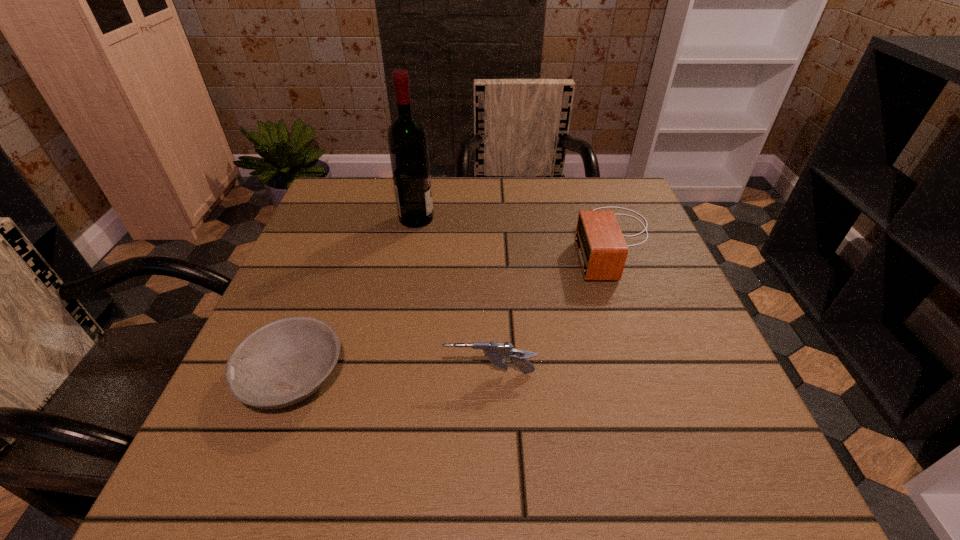
At what (x,y) coordinates should I click in order to perform the action: click on alcohol. Please return your answer as a coordinate pair (x, y). The height and width of the screenshot is (540, 960). Looking at the image, I should click on (407, 139).

Locate an element on the screen. the tallest object is located at coordinates (407, 139).

This screenshot has width=960, height=540. What are the coordinates of `the rightmost object` in the screenshot? It's located at (602, 250).

Locate an element on the screen. the second object from right to left is located at coordinates (496, 352).

Locate an element on the screen. This screenshot has width=960, height=540. the shortest object is located at coordinates (285, 361).

This screenshot has width=960, height=540. I want to click on the leftmost object, so click(285, 361).

What are the coordinates of `vacant area situated on the front and back of the alcohol` in the screenshot? It's located at (548, 219).

Where is `free space located on the front-facing side of the radio receiver`? free space located on the front-facing side of the radio receiver is located at coordinates (413, 241).

The image size is (960, 540). I want to click on vacant space positioned 0.240m on the front-facing side of the radio receiver, so click(469, 241).

Find the location of a particular element. This screenshot has height=540, width=960. vacant space located 0.320m on the front-facing side of the radio receiver is located at coordinates (434, 241).